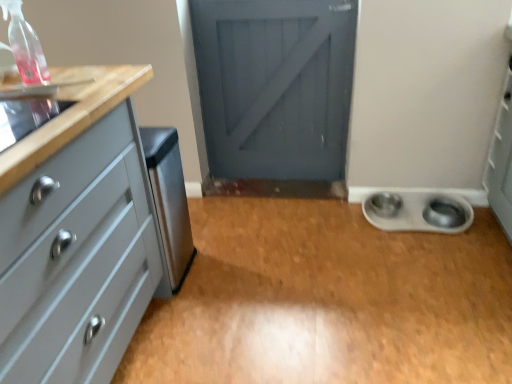
Question: Is clear plastic spray bottle at upper left to the right of silver metallic bowls at lower right, acting as the second appliance starting from the left, from the viewer's perspective?

Choices:
 (A) no
 (B) yes

Answer: (A)

Question: Is clear plastic spray bottle at upper left beside silver metallic bowls at lower right, acting as the second appliance starting from the left?

Choices:
 (A) yes
 (B) no

Answer: (B)

Question: Does clear plastic spray bottle at upper left turn towards silver metallic bowls at lower right, which ranks as the 1th appliance in right-to-left order?

Choices:
 (A) yes
 (B) no

Answer: (B)

Question: Is clear plastic spray bottle at upper left at the left side of silver metallic bowls at lower right, which is the 1th appliance from back to front?

Choices:
 (A) yes
 (B) no

Answer: (A)

Question: Is clear plastic spray bottle at upper left positioned with its back to silver metallic bowls at lower right, which ranks as the 1th appliance in right-to-left order?

Choices:
 (A) yes
 (B) no

Answer: (B)

Question: From the image's perspective, is clear plastic spray bottle at upper left above silver metallic bowls at lower right, acting as the second appliance starting from the left?

Choices:
 (A) yes
 (B) no

Answer: (A)

Question: Does clear plastic spray bottle at upper left touch matte gray chest of drawers at left?

Choices:
 (A) yes
 (B) no

Answer: (B)

Question: From the image's perspective, is clear plastic spray bottle at upper left over matte gray chest of drawers at left?

Choices:
 (A) yes
 (B) no

Answer: (A)

Question: Is clear plastic spray bottle at upper left looking in the opposite direction of matte gray chest of drawers at left?

Choices:
 (A) no
 (B) yes

Answer: (A)

Question: Is clear plastic spray bottle at upper left in front of matte gray chest of drawers at left?

Choices:
 (A) no
 (B) yes

Answer: (A)

Question: Is clear plastic spray bottle at upper left far away from matte gray chest of drawers at left?

Choices:
 (A) yes
 (B) no

Answer: (B)

Question: Considering the relative positions of clear plastic spray bottle at upper left and matte gray chest of drawers at left in the image provided, is clear plastic spray bottle at upper left behind matte gray chest of drawers at left?

Choices:
 (A) no
 (B) yes

Answer: (B)

Question: Does metallic silver bowl at lower right have a lesser width compared to clear plastic spray bottle at upper left?

Choices:
 (A) yes
 (B) no

Answer: (B)